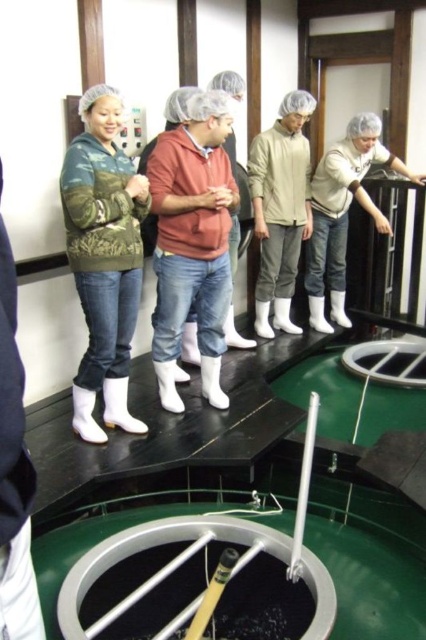
Which is below, matte beige jacket at center or white matte jacket at upper center?

white matte jacket at upper center

Who is positioned more to the left, matte beige jacket at center or white matte jacket at upper center?

matte beige jacket at center is more to the left.

Locate an element on the screen. matte beige jacket at center is located at coordinates (281, 209).

Is camo-patterned jacket at left below matte beige jacket at center?

Yes.

Who is shorter, camo-patterned jacket at left or matte beige jacket at center?

camo-patterned jacket at left

Which is behind, point (109, 308) or point (291, 236)?

The point (291, 236) is more distant.

Identify the location of camo-patterned jacket at left. The height and width of the screenshot is (640, 426). (103, 259).

Does camo-patterned jacket at left have a greater height compared to white matte jacket at upper center?

Correct, camo-patterned jacket at left is much taller as white matte jacket at upper center.

Between point (129, 179) and point (379, 157), which one is positioned behind?

The point (379, 157) is behind.

I want to click on camo-patterned jacket at left, so click(x=103, y=259).